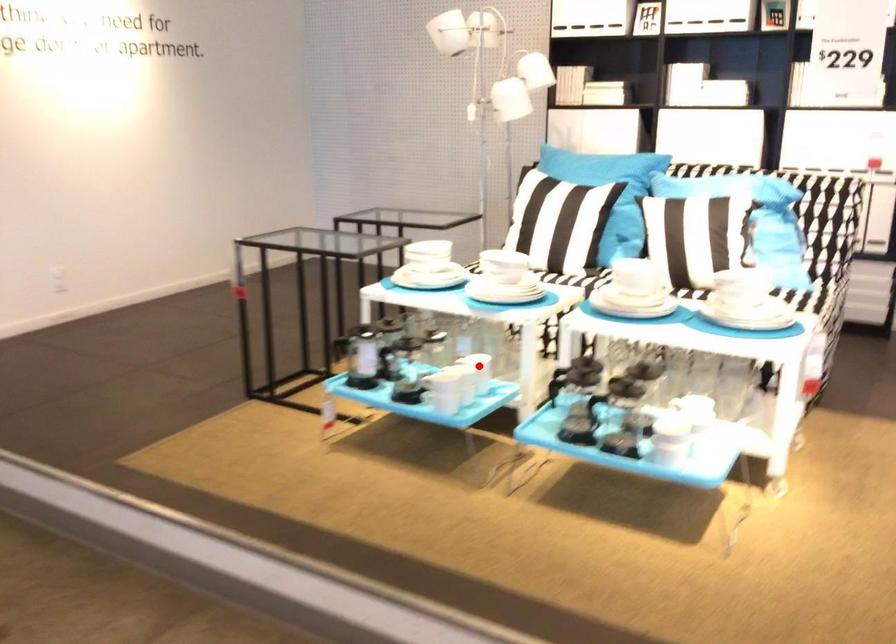
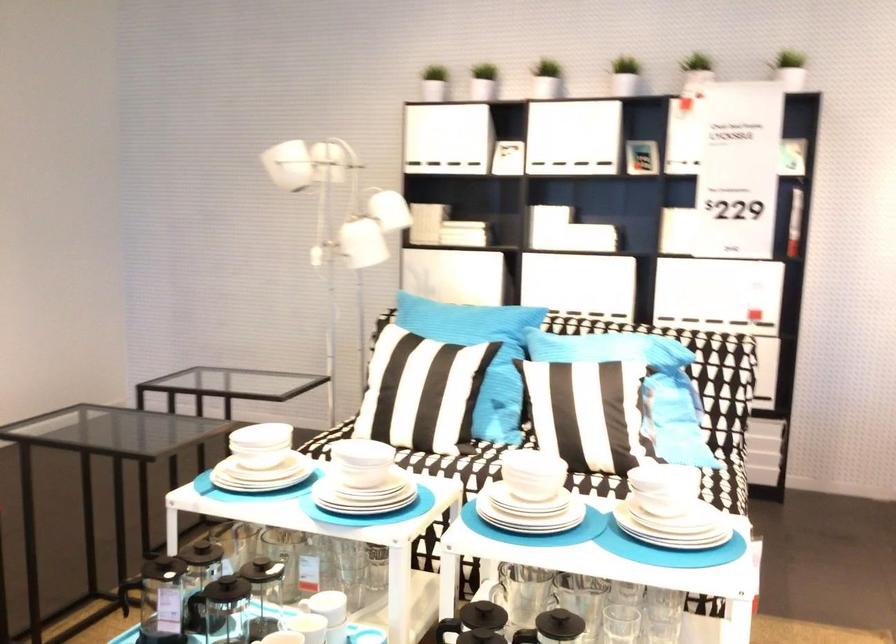
Find the pixel in the second image that matches the highlighted location in the first image.

(329, 605)